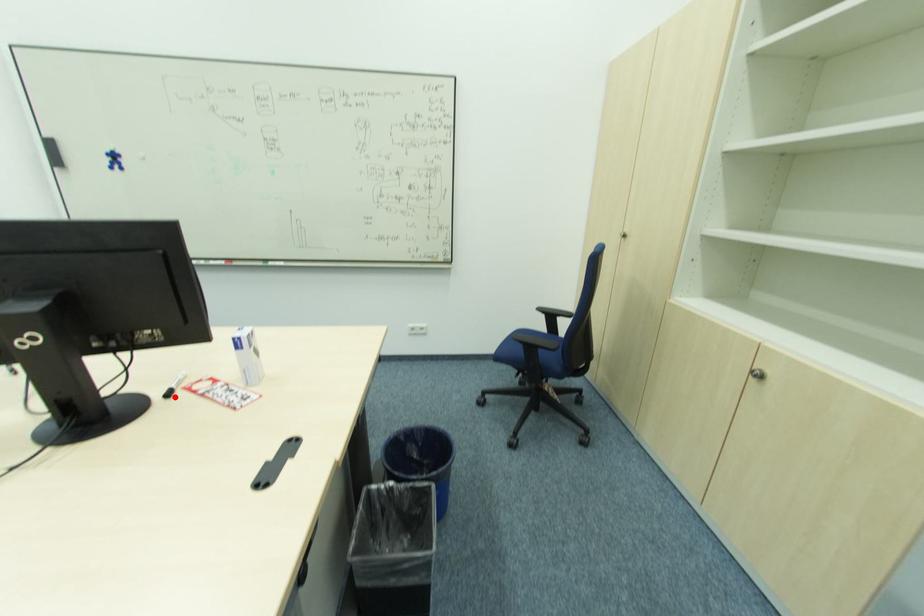
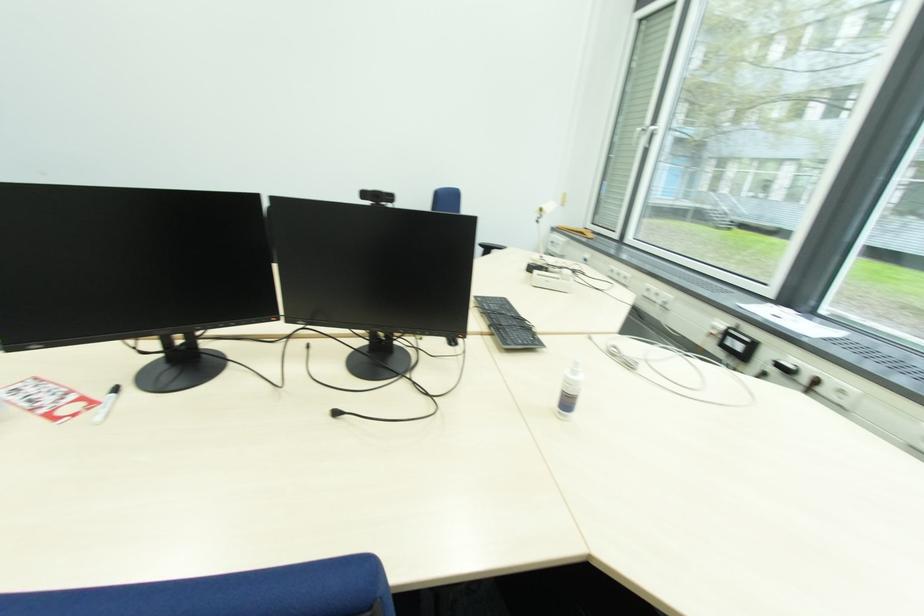
Question: I am providing you with two images of the same scene from different viewpoints. A red point is marked on the first image. Is the red point's position out of view in image 2?

Choices:
 (A) Yes
 (B) No

Answer: (B)